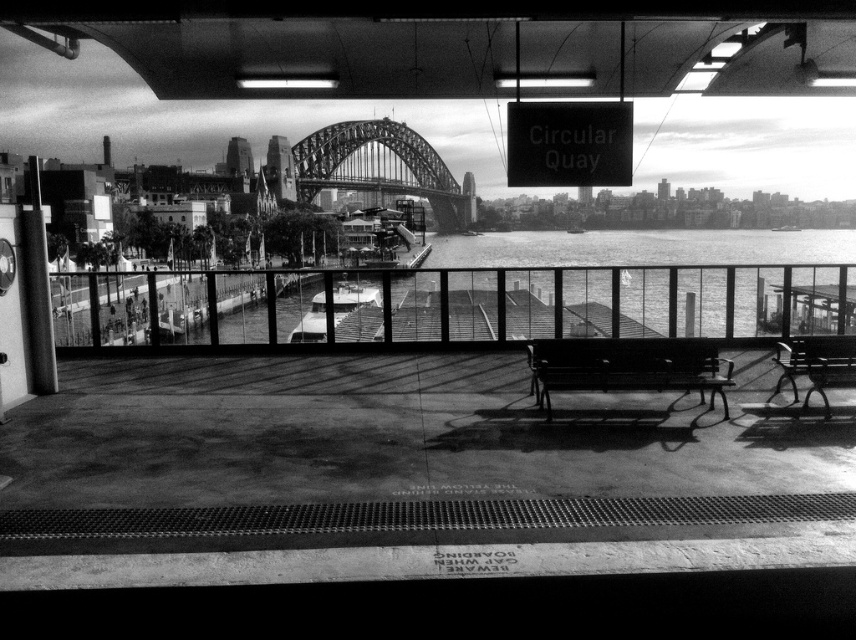
Question: Which point is closer to the camera?

Choices:
 (A) (622, 362)
 (B) (789, 273)
 (C) (776, 384)

Answer: (A)

Question: Is metallic park bench at center to the left of metallic polished bench at right from the viewer's perspective?

Choices:
 (A) yes
 (B) no

Answer: (A)

Question: Does metallic park bench at center lie in front of metallic polished bench at right?

Choices:
 (A) no
 (B) yes

Answer: (B)

Question: Is metallic park bench at center smaller than metallic polished bench at right?

Choices:
 (A) yes
 (B) no

Answer: (B)

Question: Which point is closer to the camera?

Choices:
 (A) (108, 275)
 (B) (777, 349)

Answer: (A)

Question: Which of these objects is positioned farthest from the metallic park bench at center?

Choices:
 (A) smooth water at center
 (B) metallic polished bench at right

Answer: (A)